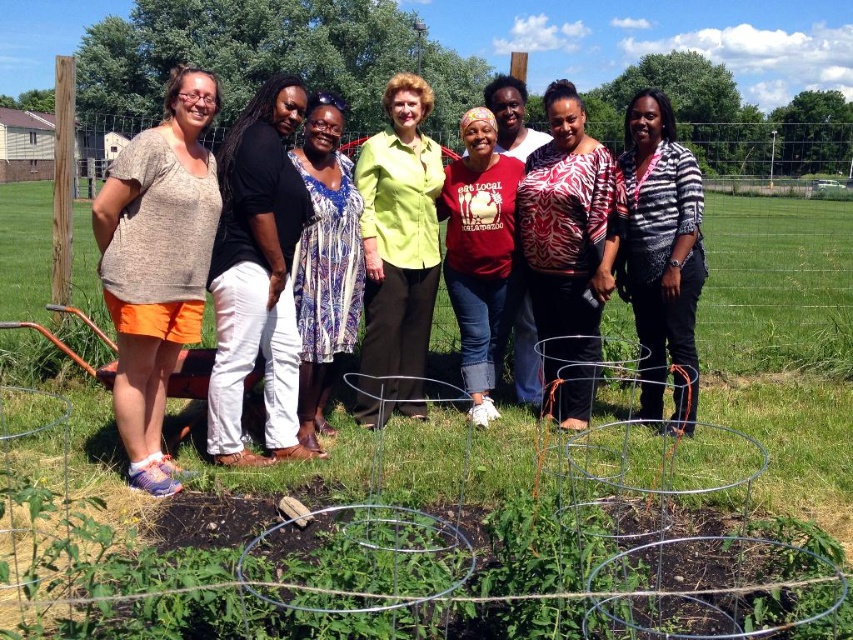
Does matte black shirt at center appear under striped cotton shirt at center?

Yes.

Can you confirm if matte black shirt at center is thinner than striped cotton shirt at center?

In fact, matte black shirt at center might be wider than striped cotton shirt at center.

This screenshot has width=853, height=640. Identify the location of matte black shirt at center. (257, 275).

Can you confirm if wire mesh garden at center is wider than green matte shirt at center?

Yes.

Who is more distant from viewer, [160,532] or [428,168]?

Point [428,168]

The width and height of the screenshot is (853, 640). Identify the location of wire mesh garden at center. (479, 528).

Does matte orange shorts at left appear under blue printed dress at center?

Incorrect, matte orange shorts at left is not positioned below blue printed dress at center.

Does matte orange shorts at left have a lesser width compared to blue printed dress at center?

Yes, matte orange shorts at left is thinner than blue printed dress at center.

Measure the distance between matte orange shorts at left and camera.

matte orange shorts at left is 3.89 meters away from camera.

The width and height of the screenshot is (853, 640). In order to click on matte orange shorts at left in this screenshot , I will do `click(157, 264)`.